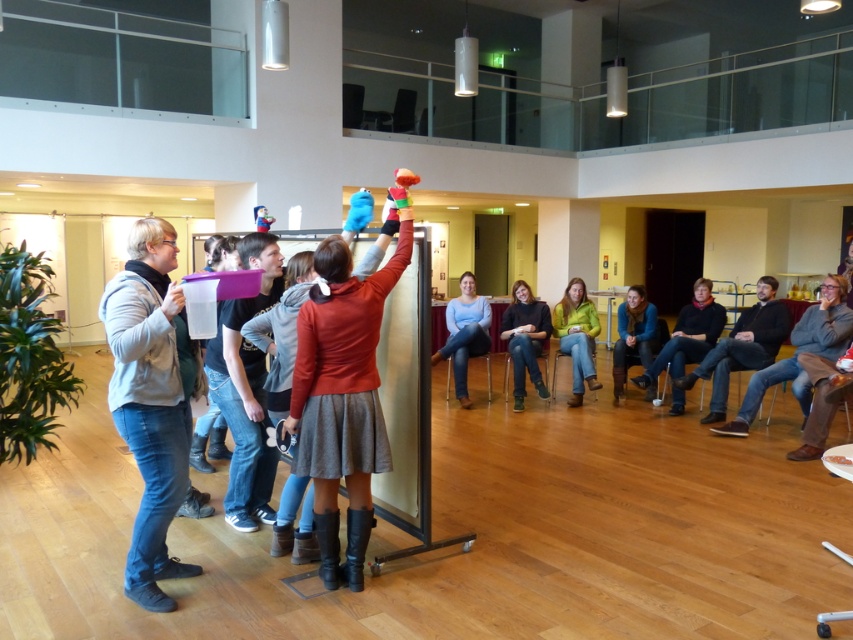
You are a photographer at the event and need to capture both the denim jeans at left and the dark blue jeans at center in a single shot. Given that your camera has a fixed focal length, which jeans should you focus on to ensure both are in frame without moving the camera?

The denim jeans at left is much taller than the dark blue jeans at center, so focusing on the denim jeans at left would ensure both are in frame since it occupies more vertical space.

You are a maintenance worker needing to reach a light fixture that is 4 meters high. You have a ladder that can extend to 4.5 meters. You see the denim jeans at left and the green fuzzy sweater at center. Can you safely place the ladder between them without it extending beyond the space?

The distance between denim jeans at left and green fuzzy sweater at center is 4.48 meters. The ladder can extend to 4.5 meters, so it will fit with minimal space to spare. Ensure the ladder is placed securely between them for safe access to the light fixture.